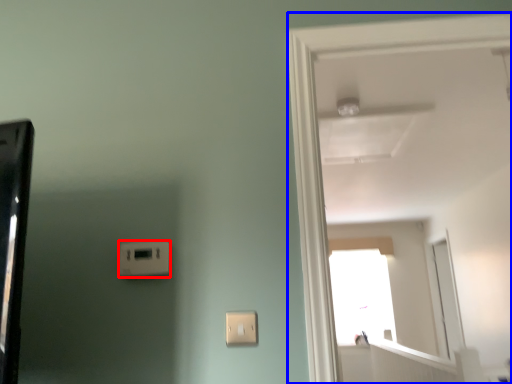
Question: Which of the following is the closest to the observer, light switch (highlighted by a red box) or door (highlighted by a blue box)?

Choices:
 (A) light switch
 (B) door

Answer: (B)